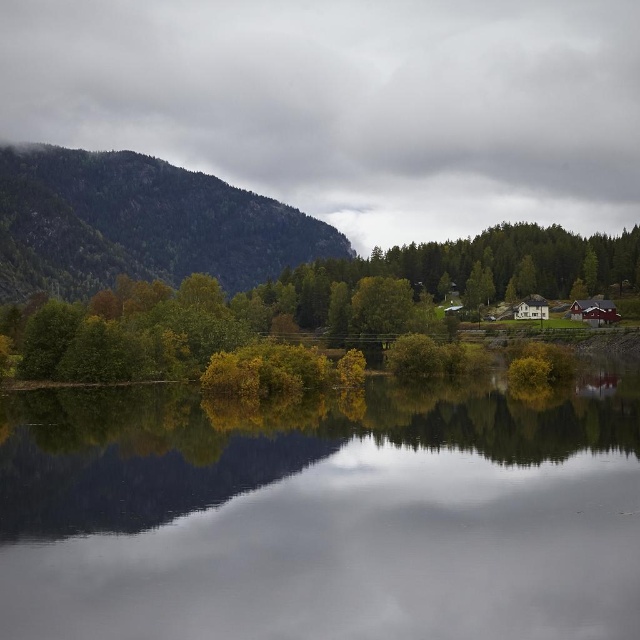
Question: Which of the following is the closest to the observer?

Choices:
 (A) green leafy trees at center
 (B) green textured mountain at left
 (C) transparent water at center

Answer: (C)

Question: Which of these objects is positioned closest to the transparent water at center?

Choices:
 (A) green leafy trees at center
 (B) green textured mountain at left

Answer: (A)

Question: Which object is closer to the camera taking this photo?

Choices:
 (A) green leafy trees at center
 (B) green textured mountain at left
 (C) transparent water at center

Answer: (C)

Question: Is transparent water at center positioned at the back of green leafy trees at center?

Choices:
 (A) yes
 (B) no

Answer: (B)

Question: Is transparent water at center thinner than green leafy trees at center?

Choices:
 (A) yes
 (B) no

Answer: (A)

Question: Is the position of transparent water at center more distant than that of green leafy trees at center?

Choices:
 (A) no
 (B) yes

Answer: (A)